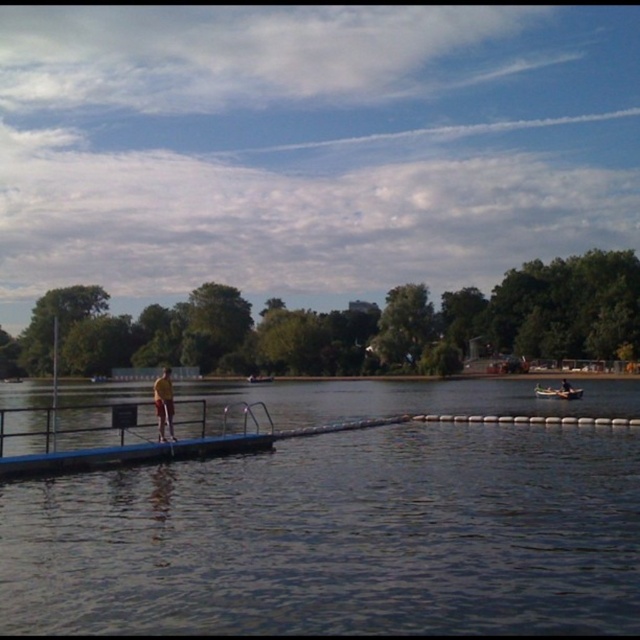
Question: Which is nearer to the wooden boat at lower right?

Choices:
 (A) wooden canoe at center
 (B) yellow fabric person at center
 (C) dark blue water at center

Answer: (C)

Question: Does dark blue water at center come behind yellow fabric person at center?

Choices:
 (A) yes
 (B) no

Answer: (B)

Question: Can you confirm if dark blue water at center is smaller than yellow fabric person at center?

Choices:
 (A) yes
 (B) no

Answer: (B)

Question: Is dark blue water at center further to the viewer compared to yellow fabric person at center?

Choices:
 (A) yes
 (B) no

Answer: (B)

Question: Which point is closer to the camera?

Choices:
 (A) click(x=156, y=403)
 (B) click(x=428, y=460)
 (C) click(x=568, y=388)
 (D) click(x=260, y=378)

Answer: (A)

Question: Among these points, which one is farthest from the camera?

Choices:
 (A) 168,410
 (B) 570,385
 (C) 269,374
 (D) 355,465

Answer: (C)